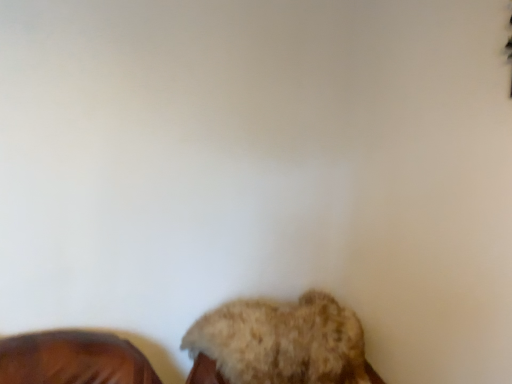
The width and height of the screenshot is (512, 384). What do you see at coordinates (283, 341) in the screenshot?
I see `fuzzy beige dog at lower center` at bounding box center [283, 341].

The image size is (512, 384). Identify the location of fuzzy beige dog at lower center. (283, 341).

Consider the image. In order to face fuzzy beige dog at lower center, should I rotate leftwards or rightwards?

To face it directly, rotate right by 9.438 degrees.

At what (x,y) coordinates should I click in order to perform the action: click on fuzzy beige dog at lower center. Please return your answer as a coordinate pair (x, y). The image size is (512, 384). Looking at the image, I should click on (283, 341).